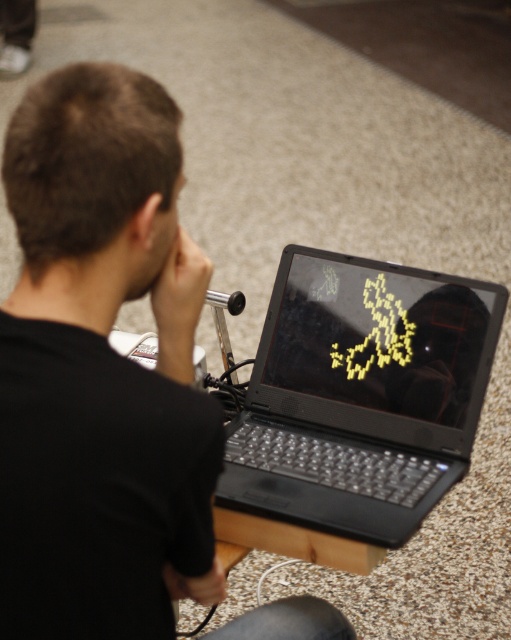
Question: Which of the following is the closest to the observer?

Choices:
 (A) black glossy laptop at center
 (B) black matte laptop at center

Answer: (B)

Question: Does black matte laptop at center appear over black glossy laptop at center?

Choices:
 (A) yes
 (B) no

Answer: (B)

Question: Can you confirm if black matte laptop at center is smaller than black glossy laptop at center?

Choices:
 (A) no
 (B) yes

Answer: (A)

Question: Which point is closer to the camera?

Choices:
 (A) (252, 372)
 (B) (353, 362)

Answer: (B)

Question: Does black matte laptop at center appear under black glossy laptop at center?

Choices:
 (A) yes
 (B) no

Answer: (A)

Question: Which point is closer to the camera taking this photo?

Choices:
 (A) (456, 420)
 (B) (316, 497)

Answer: (B)